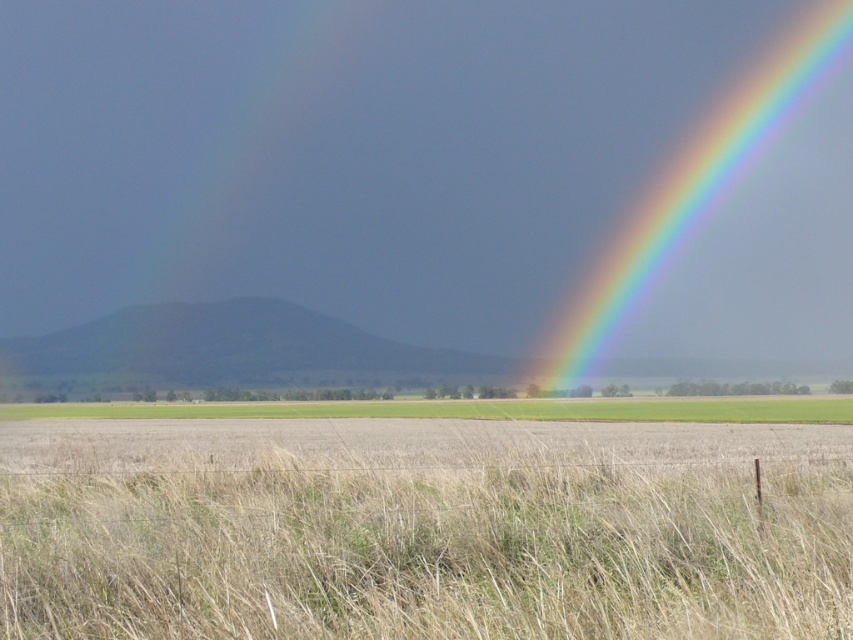
In the scene shown: You are a farmer planning to install a new irrigation system for your crops. You notice the rainbow at upper right and the green grassland at center. Which area would you prioritize for irrigation based on their positions?

The green grassland at center should be prioritized for irrigation since the rainbow at upper right is positioned over it, indicating potential rainfall in that area which may reduce the need for immediate irrigation.